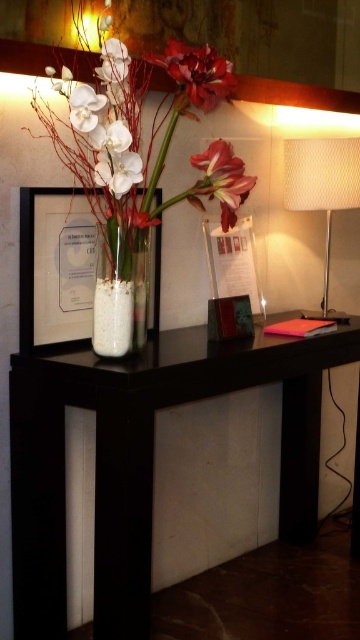
Question: Based on their relative distances, which object is farther from the white matte flower at center?

Choices:
 (A) black matte table at center
 (B) white matte vase at center

Answer: (A)

Question: Considering the relative positions of matte black frame at left and white textured lampshade at right in the image provided, where is matte black frame at left located with respect to white textured lampshade at right?

Choices:
 (A) above
 (B) below

Answer: (B)

Question: Can you confirm if black matte table at center is smaller than matte white flower at center?

Choices:
 (A) no
 (B) yes

Answer: (A)

Question: Does black matte table at center lie behind matte white flower at center?

Choices:
 (A) yes
 (B) no

Answer: (B)

Question: Which object is closer to the camera taking this photo?

Choices:
 (A) matte black frame at left
 (B) black matte table at center
 (C) white textured lampshade at right

Answer: (B)

Question: Estimate the real-world distances between objects in this image. Which object is farther from the white matte flower at center?

Choices:
 (A) white matte vase at center
 (B) matte black frame at left
 (C) matte white vase at center

Answer: (B)